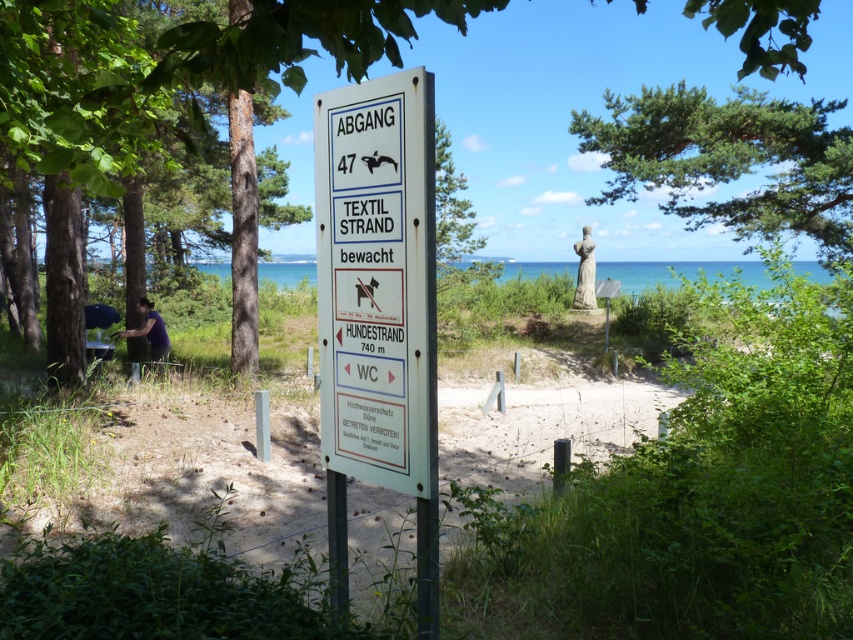
In the scene shown: You are a tourist standing at the signboard mentioned in the scene. You want to take a photo of the green leafy tree at upper center and the white sand beach at center. Which object should you focus on first if you want to capture both in one frame without moving the camera?

The green leafy tree at upper center is above the white sand beach at center, so you should focus on the green leafy tree at upper center first to ensure both are in the frame.

You are a tourist holding a purple fabric shirt at lower left and looking at the green leafy tree at upper center. Which object is wider?

The green leafy tree at upper center is wider than the purple fabric shirt at lower left.